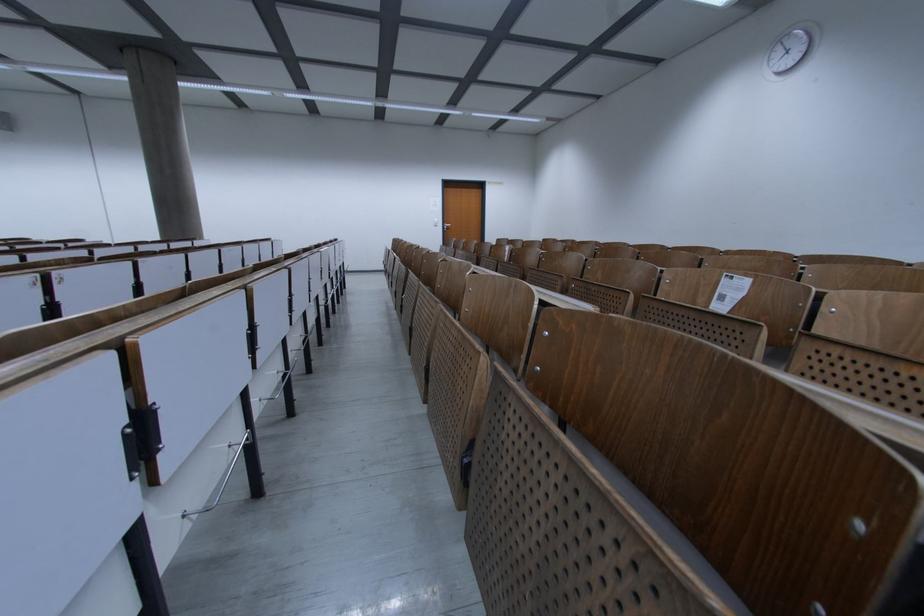
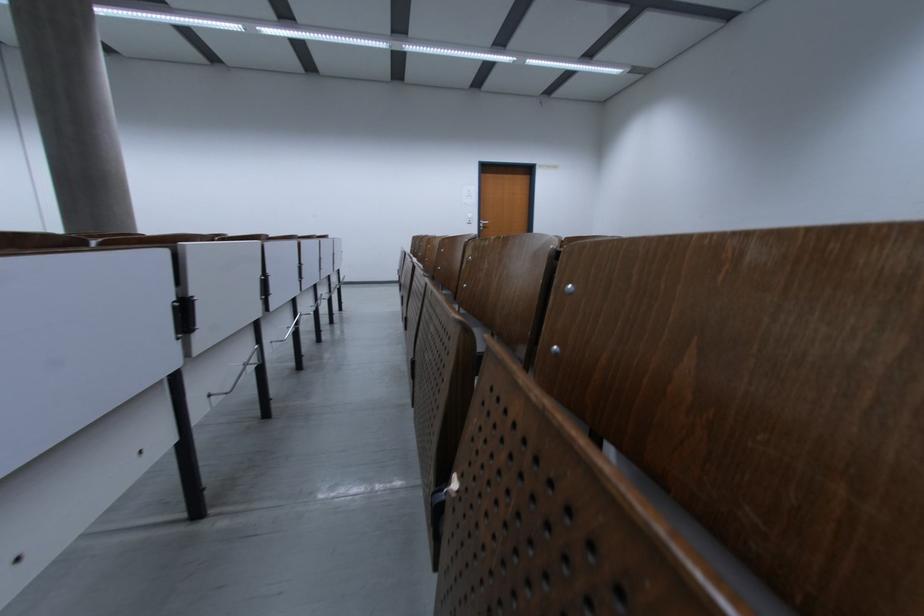
Question: What movement of the cameraman would produce the second image?

Choices:
 (A) Left
 (B) Right
 (C) Forward
 (D) Backward

Answer: (C)